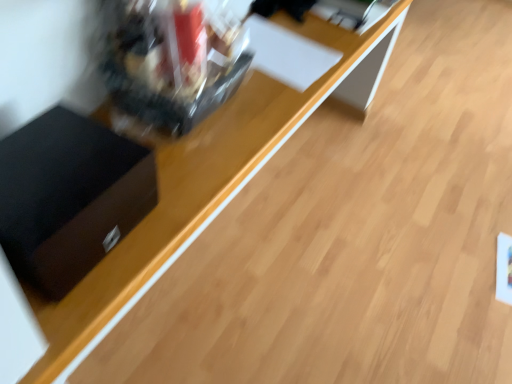
This screenshot has width=512, height=384. Find the location of `blank space above black matte drawer at left (from a real-world perspective)`. blank space above black matte drawer at left (from a real-world perspective) is located at coordinates (60, 162).